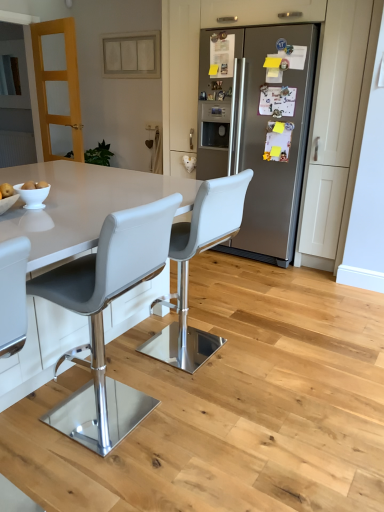
What are the coordinates of `free spot to the right of white leather stool at center, which appears as the 1th chair when viewed from the back` in the screenshot? It's located at (262, 352).